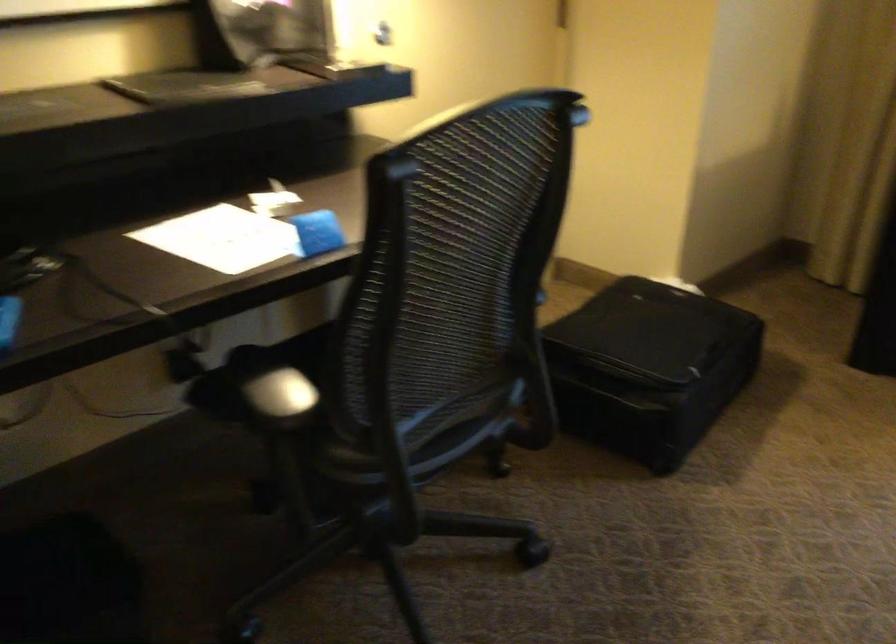
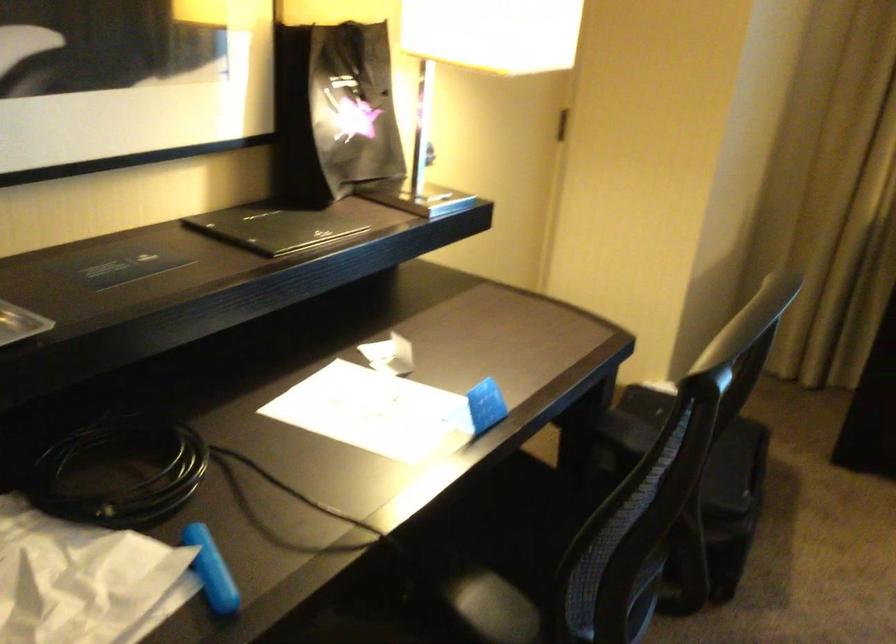
Find the pixel in the second image that matches pixel 309 236 in the first image.

(479, 408)